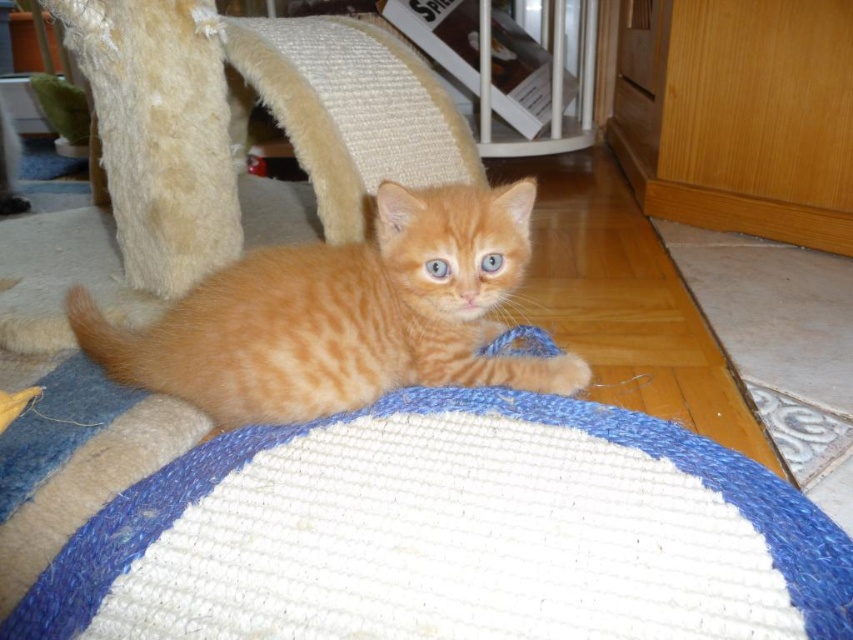
You are a cat owner who wants to place a new cat bed for your kitten. The kitten is currently lying on a blue and white circular mat. There is a white knitted cat bed at center located at point (326, 426). Considering the existing furniture like the cat scratching post and the wooden floor, where should you place the new cat bed to avoid blocking the kitten from reaching its scratching post?

The white knitted cat bed at center is already placed at point (326, 426). To avoid blocking the kitten from reaching the scratching post, ensure the new cat bed is placed away from the path between the kitten and the scratching post.

You are a cat owner who wants to ensure your orange fur cat at center has enough space to move around on the white knitted cat bed at center. Given that the cat is 12 inches long, can the cat comfortably stretch out on the bed?

The white knitted cat bed at center is only 6.03 inches from the orange fur cat at center, which is much smaller than the cat. The cat would not have enough space to stretch out comfortably.

You are a cat owner who wants to place a small toy in the center of the white knitted cat bed at center. Based on the image, can you determine the exact coordinates where you should place the toy?

The exact coordinates for the center of the white knitted cat bed at center are at point (326, 426).